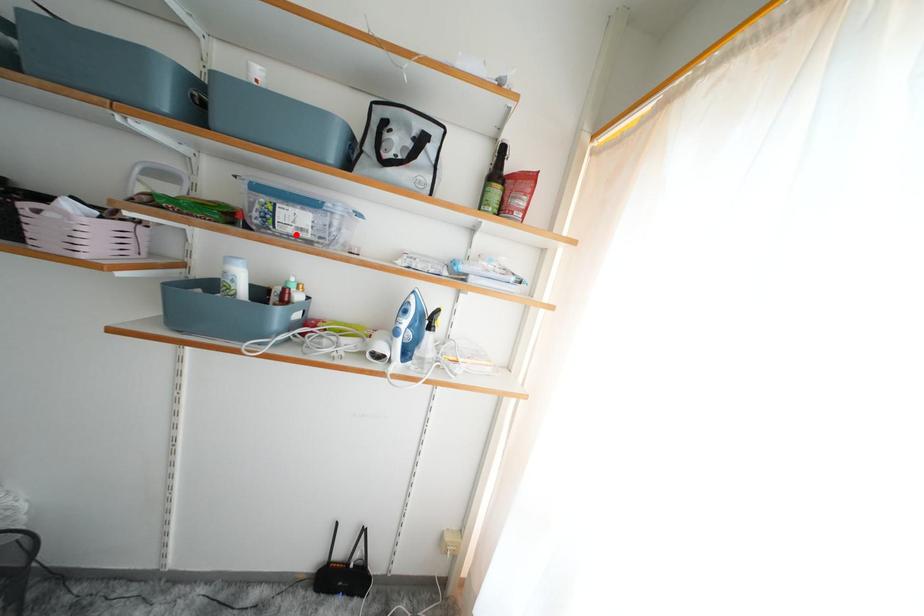
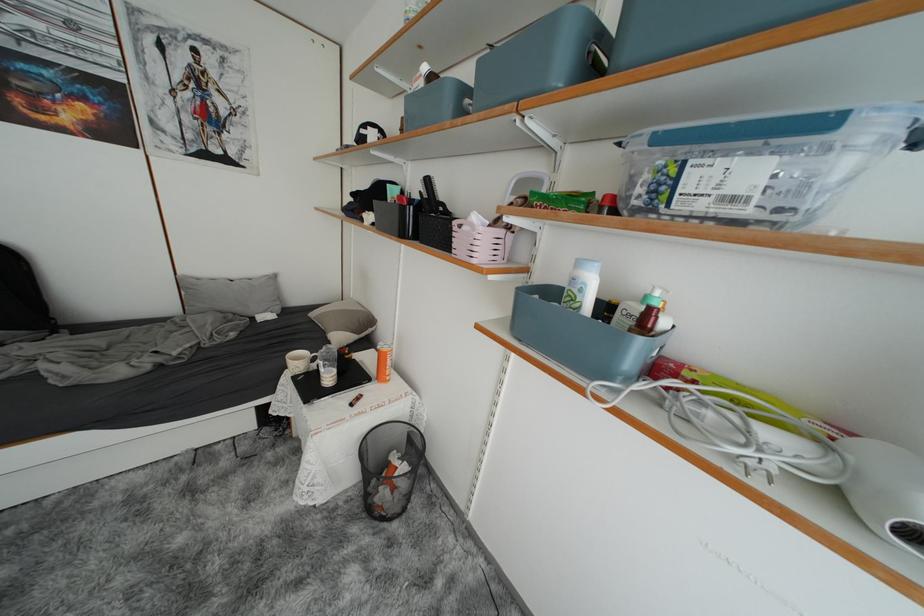
The point at the highlighted location is marked in the first image. Where is the corresponding point in the second image?

(709, 209)